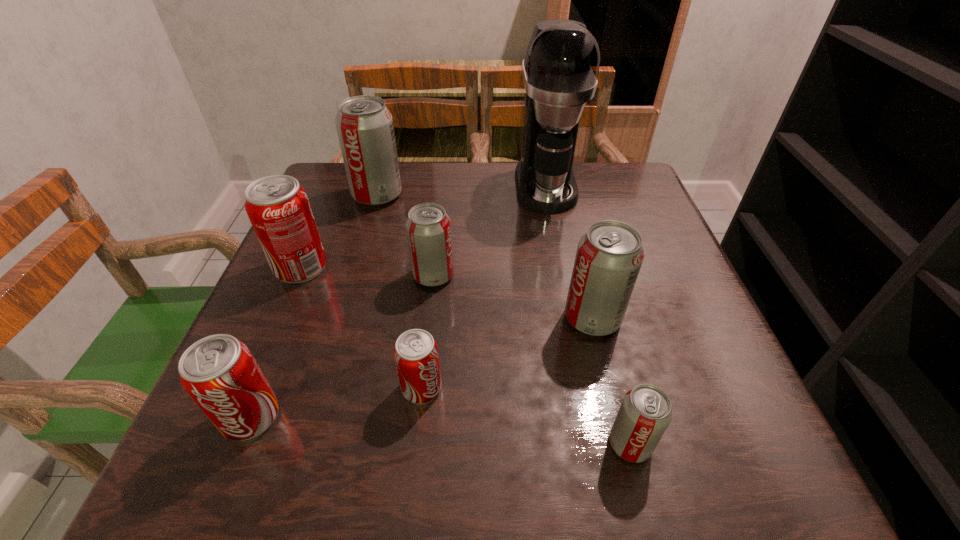
Locate an element on the screen. coffee maker is located at coordinates (560, 70).

I want to click on the farthest gray soda can, so click(x=364, y=124).

Locate an element on the screen. the tallest soda can is located at coordinates (364, 124).

This screenshot has width=960, height=540. I want to click on the biggest red soda can, so (278, 207).

Where is `the fourth nearest soda can`? the fourth nearest soda can is located at coordinates (609, 255).

I want to click on the fourth nearest object, so click(x=609, y=255).

Image resolution: width=960 pixels, height=540 pixels. Find the location of `the third biggest gray soda can`. the third biggest gray soda can is located at coordinates (428, 227).

In order to click on the second farthest gray soda can in this screenshot , I will do `click(428, 227)`.

Locate an element on the screen. The height and width of the screenshot is (540, 960). the second biggest red soda can is located at coordinates (219, 372).

Where is `the rightmost red soda can`? The image size is (960, 540). the rightmost red soda can is located at coordinates (416, 356).